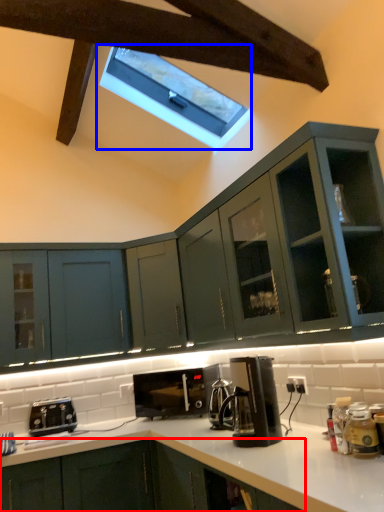
Question: Which object appears closest to the camera in this image, cabinetry (highlighted by a red box) or window (highlighted by a blue box)?

Choices:
 (A) cabinetry
 (B) window

Answer: (A)